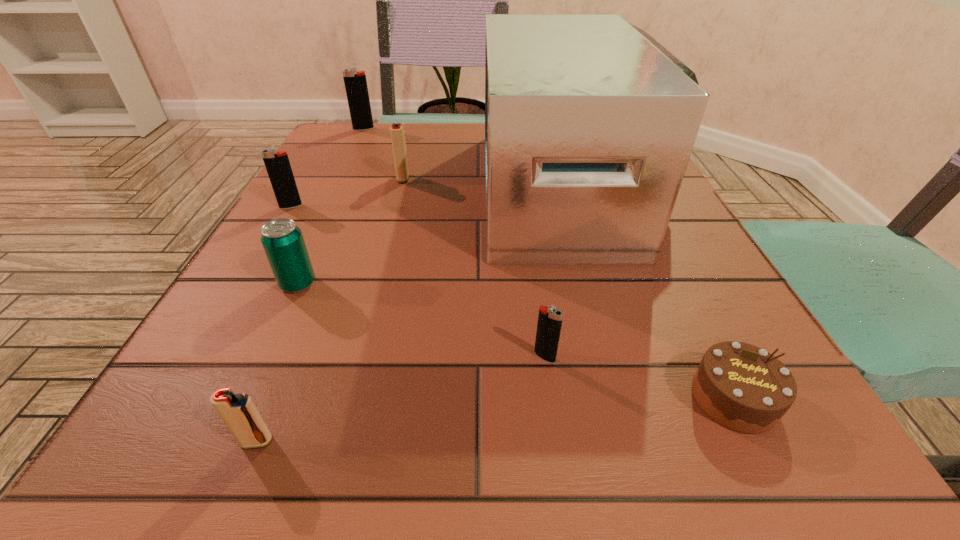
Find the location of a particular element. The width and height of the screenshot is (960, 540). vacant point located between the fourth farthest igniter and the third igniter from left to right is located at coordinates (400, 399).

This screenshot has width=960, height=540. I want to click on vacant space that's between the shortest object and the microwave oven, so click(x=653, y=294).

Identify which object is the third nearest to the shortest object. Please provide its 2D coordinates. Your answer should be formatted as a tuple, i.e. [(x, y)], where the tuple contains the x and y coordinates of a point satisfying the conditions above.

[(239, 413)]

Locate an element on the screen. The image size is (960, 540). object that is the fifth nearest to the seventh shortest object is located at coordinates tap(549, 324).

This screenshot has width=960, height=540. I want to click on igniter that is the fifth closest to the chocolate cake, so click(356, 87).

Locate an element on the screen. the third closest igniter relative to the nearest black igniter is located at coordinates [x=278, y=167].

Select which black igniter appears as the second closest to the brown chocolate cake. Please provide its 2D coordinates. Your answer should be formatted as a tuple, i.e. [(x, y)], where the tuple contains the x and y coordinates of a point satisfying the conditions above.

[(278, 167)]

Identify the location of black igniter that is the nearest to the farthest igniter. (278, 167).

At what (x,y) coordinates should I click in order to perform the action: click on vacant space that satisfies the following two spatial constraints: 1. on the front-facing side of the microwave oven; 2. on the front side of the leftmost igniter. Please return your answer as a coordinate pair (x, y). The height and width of the screenshot is (540, 960). Looking at the image, I should click on point(577,206).

Find the location of a particular element. The height and width of the screenshot is (540, 960). free space in the image that satisfies the following two spatial constraints: 1. on the front side of the tallest igniter; 2. on the left side of the fourth object from right to left is located at coordinates (339, 178).